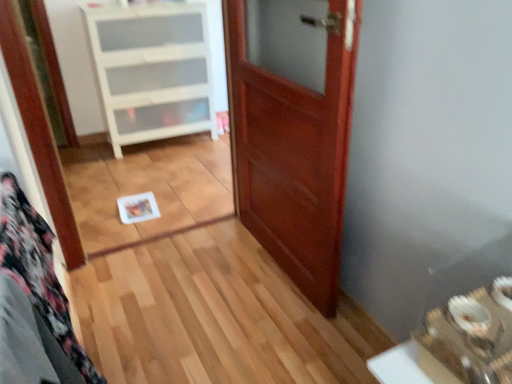
Question: Is mahogany wood door at center taller or shorter than white plastic cabinet at upper left?

Choices:
 (A) short
 (B) tall

Answer: (B)

Question: Is mahogany wood door at center in front of or behind white plastic cabinet at upper left in the image?

Choices:
 (A) behind
 (B) front

Answer: (B)

Question: Is mahogany wood door at center inside the boundaries of white plastic cabinet at upper left, or outside?

Choices:
 (A) outside
 (B) inside

Answer: (A)

Question: Is point (119, 99) closer or farther from the camera than point (338, 117)?

Choices:
 (A) closer
 (B) farther

Answer: (B)

Question: Is white plastic cabinet at upper left in front of or behind mahogany wood door at center in the image?

Choices:
 (A) behind
 (B) front

Answer: (A)

Question: From a real-world perspective, is white plastic cabinet at upper left positioned above or below mahogany wood door at center?

Choices:
 (A) below
 (B) above

Answer: (A)

Question: Is white plastic cabinet at upper left to the left or to the right of mahogany wood door at center in the image?

Choices:
 (A) right
 (B) left

Answer: (B)